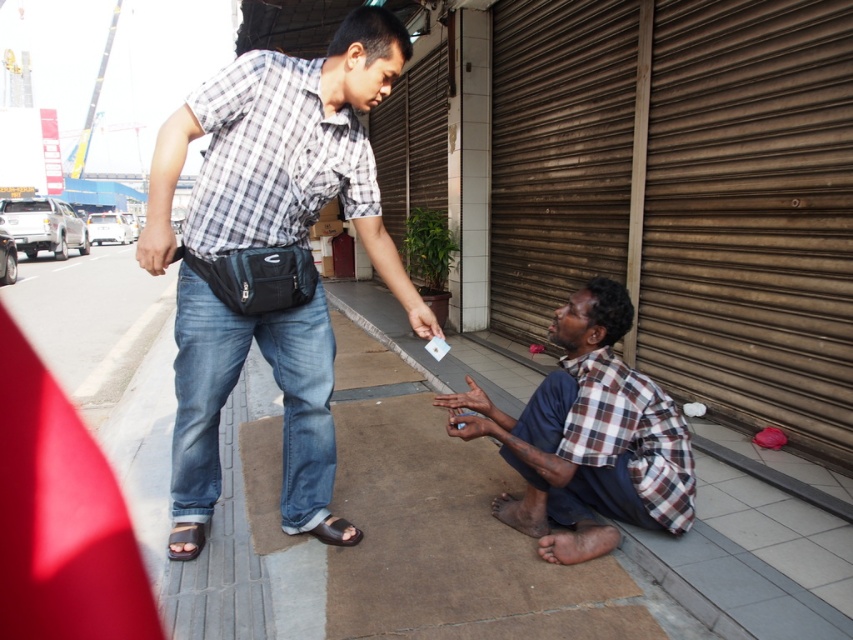
You are standing on the sidewalk and see the brown checkered shirt at lower center and the brown leather sandal at lower left. Which object is located to the right of the other?

The brown checkered shirt at lower center is positioned on the right side of brown leather sandal at lower left.

You are a photographer standing 10 feet away from the camera. You want to place your tripod on the brown corrugated metal at lower right. Can you reach the metal without moving your tripod more than 2 feet from your current position?

The distance between you and the brown corrugated metal at lower right is 8.04 feet. Since you can move the tripod only 2 feet from your current position, you need to be within 8.04 minus 2 equals 6.04 feet from the metal. However, you are 10 feet away, so you are too far to reach it without moving more than 2 feet.